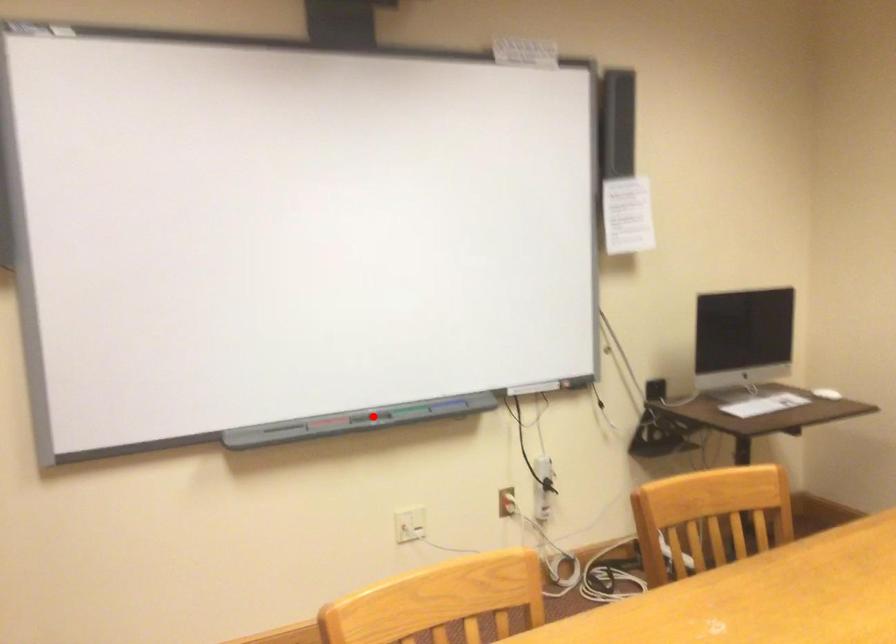
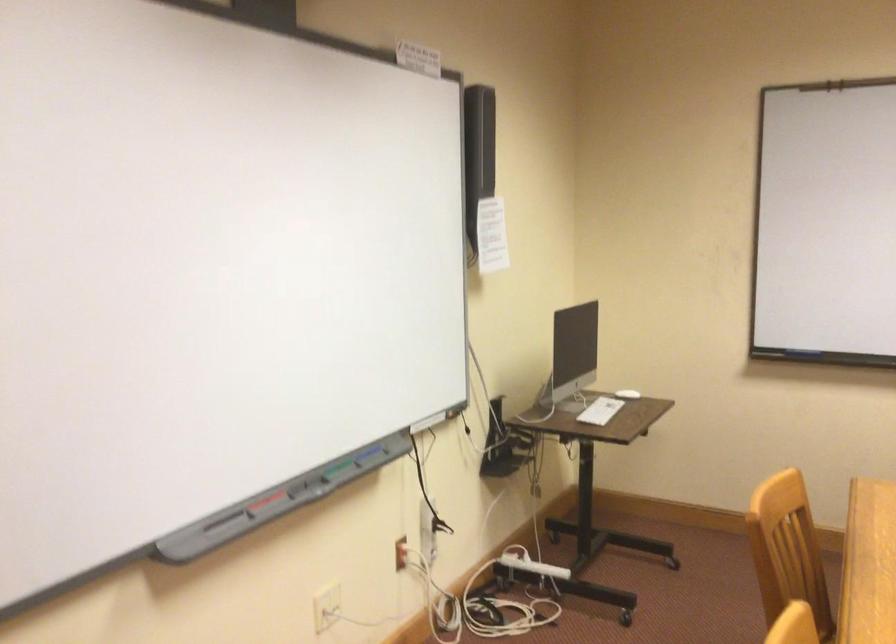
Question: I am providing you with two images of the same scene from different viewpoints. Image1 has a red point marked. In image2, the corresponding 3D location appears at what relative position? Reply with the corresponding letter.

Choices:
 (A) Closer
 (B) Farther

Answer: (A)